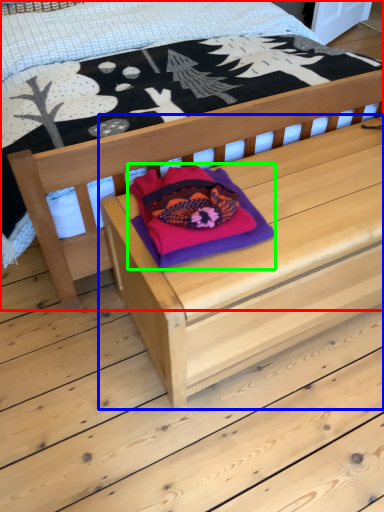
Question: Which is farther away from bed (highlighted by a red box)? table (highlighted by a blue box) or throw pillow (highlighted by a green box)?

Choices:
 (A) table
 (B) throw pillow

Answer: (B)